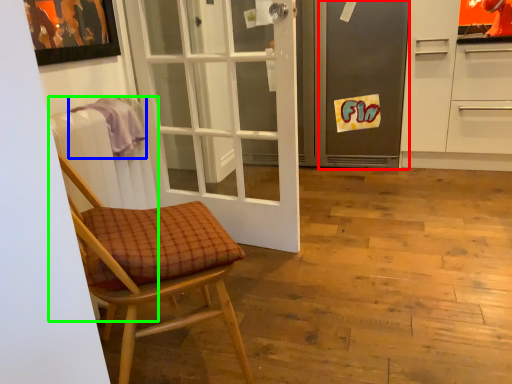
Question: Considering the real-world distances, which object is closest to screen door (highlighted by a red box)? towel/napkin (highlighted by a blue box) or radiator (highlighted by a green box).

Choices:
 (A) towel/napkin
 (B) radiator

Answer: (A)